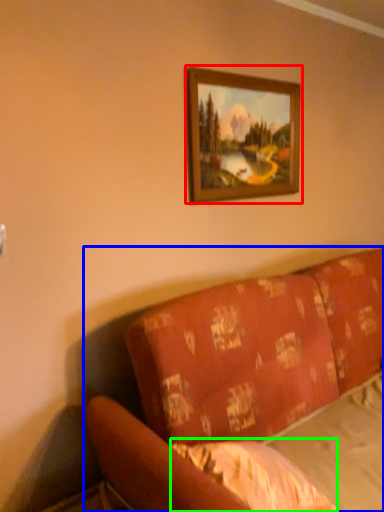
Question: Based on their relative distances, which object is nearer to picture frame (highlighted by a red box)? Choose from studio couch (highlighted by a blue box) and sheet (highlighted by a green box).

Choices:
 (A) studio couch
 (B) sheet

Answer: (A)